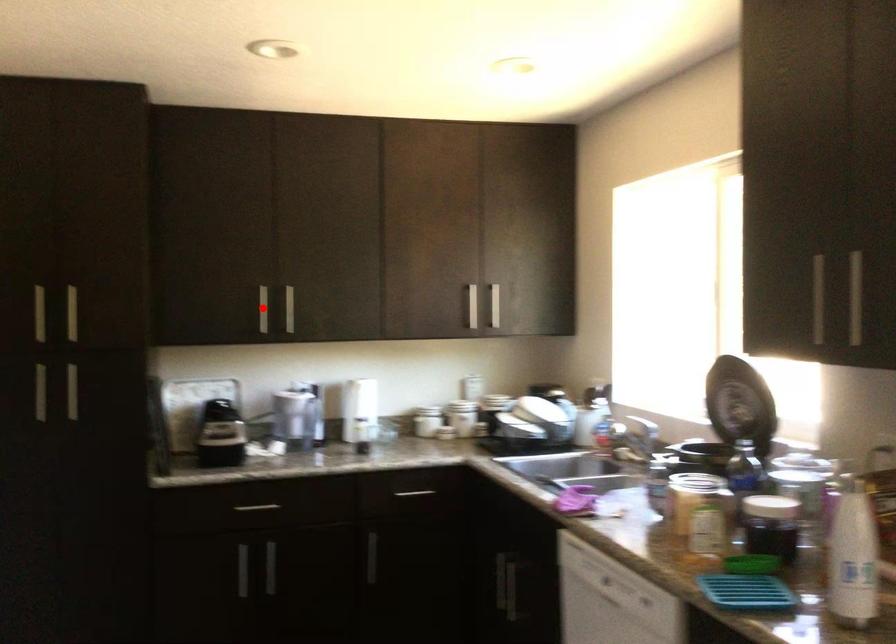
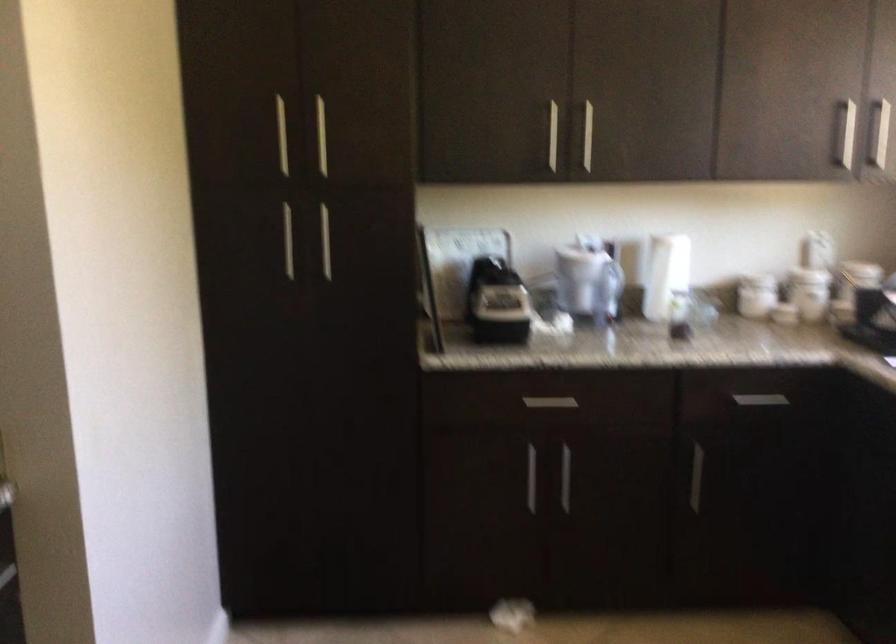
Question: A red point is marked in image1. In image2, is the corresponding 3D point closer to the camera or farther? Reply with the corresponding letter.

Choices:
 (A) The corresponding 3D point is closer.
 (B) The corresponding 3D point is farther.

Answer: (A)